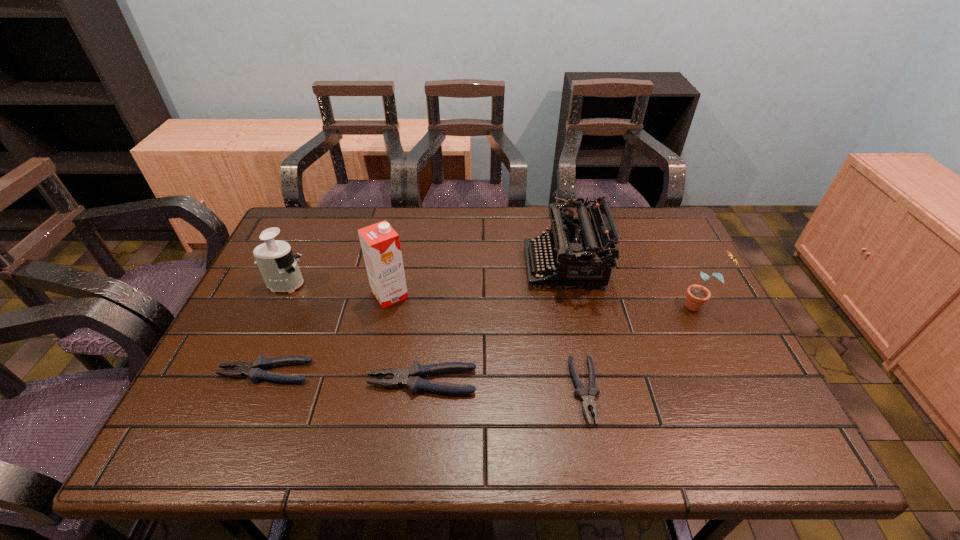
You are a GUI agent. You are given a task and a screenshot of the screen. Output one action in this format:
    pyautogui.click(x=<x>, y=<y>)
    Task: Click on the vacant space that's between the second shortest object and the typewriter
    The width and height of the screenshot is (960, 540).
    Given the screenshot: What is the action you would take?
    pyautogui.click(x=415, y=319)

Point out which object is positioned as the fourth nearest to the second shortest object. Please provide its 2D coordinates. Your answer should be formatted as a tuple, i.e. [(x, y)], where the tuple contains the x and y coordinates of a point satisfying the conditions above.

[(582, 251)]

Identify the location of the fifth closest object to the juicer. The height and width of the screenshot is (540, 960). (588, 401).

Locate which pliers ranks second in proximity to the juicer. Please provide its 2D coordinates. Your answer should be formatted as a tuple, i.e. [(x, y)], where the tuple contains the x and y coordinates of a point satisfying the conditions above.

[(411, 378)]

You are a GUI agent. You are given a task and a screenshot of the screen. Output one action in this format:
    pyautogui.click(x=<x>, y=<y>)
    Task: Click on the pliers identified as the second closest to the rightmost object
    The width and height of the screenshot is (960, 540).
    Given the screenshot: What is the action you would take?
    pyautogui.click(x=411, y=378)

Locate an element on the screen. free spot that satisfies the following two spatial constraints: 1. on the flower of the sunflower; 2. at the gripping part of the shortest pliers is located at coordinates (x=742, y=391).

Locate an element on the screen. This screenshot has height=540, width=960. free spot that satisfies the following two spatial constraints: 1. on the flower of the sunflower; 2. at the gripping part of the rightmost pliers is located at coordinates (742, 391).